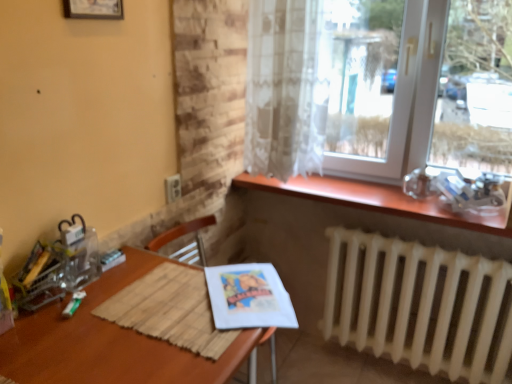
Describe the element at coordinates (377, 87) in the screenshot. I see `transparent glass window at upper right` at that location.

Measure the distance between wooden at upper right and camera.

wooden at upper right and camera are 5.28 feet apart from each other.

Describe the element at coordinates (93, 9) in the screenshot. I see `wooden picture frame at upper left` at that location.

This screenshot has width=512, height=384. I want to click on white matte radiator at lower right, so click(x=420, y=304).

Where is `sheer white curtain at upper right`? sheer white curtain at upper right is located at coordinates (286, 88).

The image size is (512, 384). Describe the element at coordinates (286, 88) in the screenshot. I see `sheer white curtain at upper right` at that location.

In order to click on transparent glass window at upper right in this screenshot , I will do [377, 87].

Between matte paper magazine at lower center and wooden armchair at center, which one is positioned in front?

wooden armchair at center.

Does matte paper magazine at lower center appear on the left side of wooden armchair at center?

No, matte paper magazine at lower center is not to the left of wooden armchair at center.

Would you say matte paper magazine at lower center is a long distance from wooden armchair at center?

No, matte paper magazine at lower center is in close proximity to wooden armchair at center.

Measure the distance from matte paper magazine at lower center to wooden armchair at center.

A distance of 18.88 inches exists between matte paper magazine at lower center and wooden armchair at center.

Is wooden picture frame at upper left taller or shorter than white matte radiator at lower right?

wooden picture frame at upper left is shorter than white matte radiator at lower right.

From the image's perspective, does wooden picture frame at upper left appear lower than white matte radiator at lower right?

No, from the image's perspective, wooden picture frame at upper left is not beneath white matte radiator at lower right.

Is the depth of wooden picture frame at upper left less than that of white matte radiator at lower right?

Yes, wooden picture frame at upper left is closer to the camera.

Is point (84, 16) in front of point (397, 259)?

Yes, point (84, 16) is in front of point (397, 259).

From the picture: Is sheer white curtain at upper right aimed at brown wooden table at center?

Yes, sheer white curtain at upper right is facing brown wooden table at center.

Is sheer white curtain at upper right at the left side of brown wooden table at center?

No, sheer white curtain at upper right is not to the left of brown wooden table at center.

Can you tell me how much sheer white curtain at upper right and brown wooden table at center differ in facing direction?

There is a 88.9-degree angle between the facing directions of sheer white curtain at upper right and brown wooden table at center.

From the image's perspective, is sheer white curtain at upper right beneath transparent glass window at upper right?

No, from the image's perspective, sheer white curtain at upper right is not below transparent glass window at upper right.

Is transparent glass window at upper right located within sheer white curtain at upper right?

No, transparent glass window at upper right is not surrounded by sheer white curtain at upper right.

Is sheer white curtain at upper right wider or thinner than transparent glass window at upper right?

Considering their sizes, sheer white curtain at upper right looks slimmer than transparent glass window at upper right.

Are sheer white curtain at upper right and transparent glass window at upper right located far from each other?

sheer white curtain at upper right is near transparent glass window at upper right, not far away.

From a real-world perspective, is brown wooden table at center physically located above or below matte paper magazine at lower center?

From a real-world perspective, brown wooden table at center is physically above matte paper magazine at lower center.

Between brown wooden table at center and matte paper magazine at lower center, which one appears on the right side from the viewer's perspective?

From the viewer's perspective, matte paper magazine at lower center appears more on the right side.

In the image, is brown wooden table at center positioned in front of or behind matte paper magazine at lower center?

brown wooden table at center is positioned closer to the viewer than matte paper magazine at lower center.

Considering the sizes of objects brown wooden table at center and matte paper magazine at lower center in the image provided, who is thinner, brown wooden table at center or matte paper magazine at lower center?

Thinner between the two is matte paper magazine at lower center.

Which is more to the left, sheer white curtain at upper right or wooden picture frame at upper left?

wooden picture frame at upper left.

Between sheer white curtain at upper right and wooden picture frame at upper left, which one has less height?

wooden picture frame at upper left is shorter.

You are a GUI agent. You are given a task and a screenshot of the screen. Output one action in this format:
    pyautogui.click(x=<x>, y=<y>)
    Task: Click on the picture frame above the sheer white curtain at upper right (from the image's perspective)
    This screenshot has width=512, height=384.
    Given the screenshot: What is the action you would take?
    pyautogui.click(x=93, y=9)

Is white matte radiator at lower right looking in the opposite direction of wooden picture frame at upper left?

No, white matte radiator at lower right's orientation is not away from wooden picture frame at upper left.

From a real-world perspective, relative to wooden picture frame at upper left, is white matte radiator at lower right vertically above or below?

white matte radiator at lower right is below wooden picture frame at upper left.

Where is `radiator below the wooden picture frame at upper left (from the image's perspective)`? This screenshot has width=512, height=384. radiator below the wooden picture frame at upper left (from the image's perspective) is located at coordinates (420, 304).

Find the location of a particular element. magazine that is behind the wooden armchair at center is located at coordinates (248, 297).

This screenshot has height=384, width=512. I want to click on radiator on the right of wooden picture frame at upper left, so click(420, 304).

Considering their positions, is wooden at upper right positioned further to white matte radiator at lower right than wooden armchair at center?

wooden armchair at center is positioned further to the anchor white matte radiator at lower right.

From the image, which object appears to be farther from matte paper magazine at lower center, wooden armchair at center or sheer white curtain at upper right?

sheer white curtain at upper right is positioned further to the anchor matte paper magazine at lower center.

From the image, which object appears to be nearer to white matte radiator at lower right, sheer white curtain at upper right or matte paper magazine at lower center?

sheer white curtain at upper right.

Looking at the image, which one is located further to sheer white curtain at upper right, wooden picture frame at upper left or matte paper magazine at lower center?

Based on the image, wooden picture frame at upper left appears to be further to sheer white curtain at upper right.

When comparing their distances from wooden armchair at center, does white matte radiator at lower right or sheer white curtain at upper right seem closer?

sheer white curtain at upper right lies closer to wooden armchair at center than the other object.

When comparing their distances from brown wooden table at center, does wooden at upper right or wooden armchair at center seem further?

wooden at upper right lies further to brown wooden table at center than the other object.

Looking at this image, based on their spatial positions, is wooden at upper right or white matte radiator at lower right closer to wooden armchair at center?

The object closer to wooden armchair at center is wooden at upper right.

From the image, which object appears to be nearer to white matte radiator at lower right, brown wooden table at center or sheer white curtain at upper right?

Based on the image, sheer white curtain at upper right appears to be nearer to white matte radiator at lower right.

Find the location of a particular element. The height and width of the screenshot is (384, 512). window sill between wooden picture frame at upper left and matte paper magazine at lower center from top to bottom is located at coordinates (376, 200).

What are the coordinates of `armchair between transparent glass window at upper right and white matte radiator at lower right from top to bottom` in the screenshot? It's located at [183, 235].

You are a GUI agent. You are given a task and a screenshot of the screen. Output one action in this format:
    pyautogui.click(x=<x>, y=<y>)
    Task: Click on the window sill between sheer white curtain at upper right and matte paper magazine at lower center in the up-down direction
    
    Given the screenshot: What is the action you would take?
    click(376, 200)

Locate an element on the screen. window sill between wooden picture frame at upper left and transparent glass window at upper right in the horizontal direction is located at coordinates (376, 200).